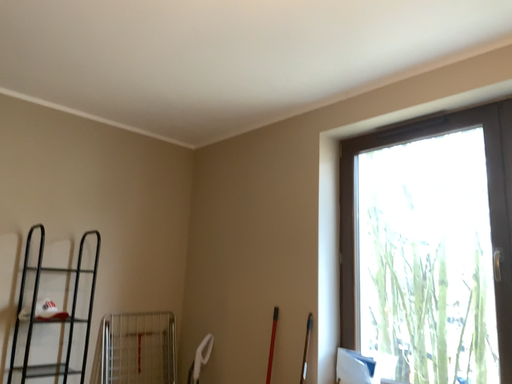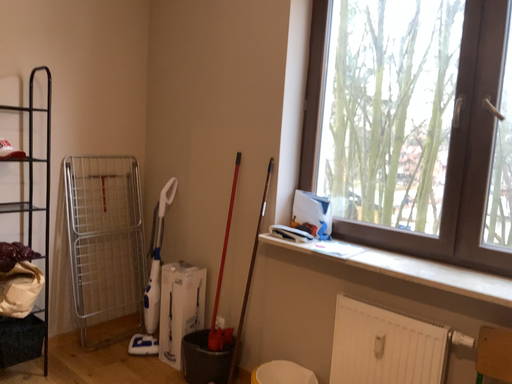
Question: How did the camera likely rotate when shooting the video?

Choices:
 (A) rotated upward
 (B) rotated downward

Answer: (B)